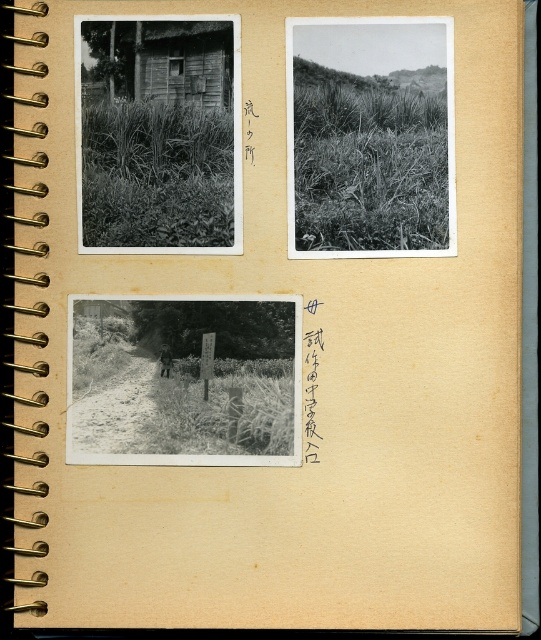
Based on the scene described, which of the two grassy areas, the grassy field at upper right or the grassy vegetation at upper left, is positioned higher in the album page layout?

The grassy field at upper right is located above the grassy vegetation at upper left in the album page layout.

Consider the image. Based on the scene described, which object corresponds to the coordinate point (367,163)?

The grassy field at upper right corresponds to the coordinate point (367,163).

You are looking at a photo album page with a wooden hut at upper left and a grassy textured field at bottom center. Based on their positions, which object is farther to the right?

The grassy textured field at bottom center is farther to the right compared to the wooden hut at upper left, as it is positioned to the right of it.